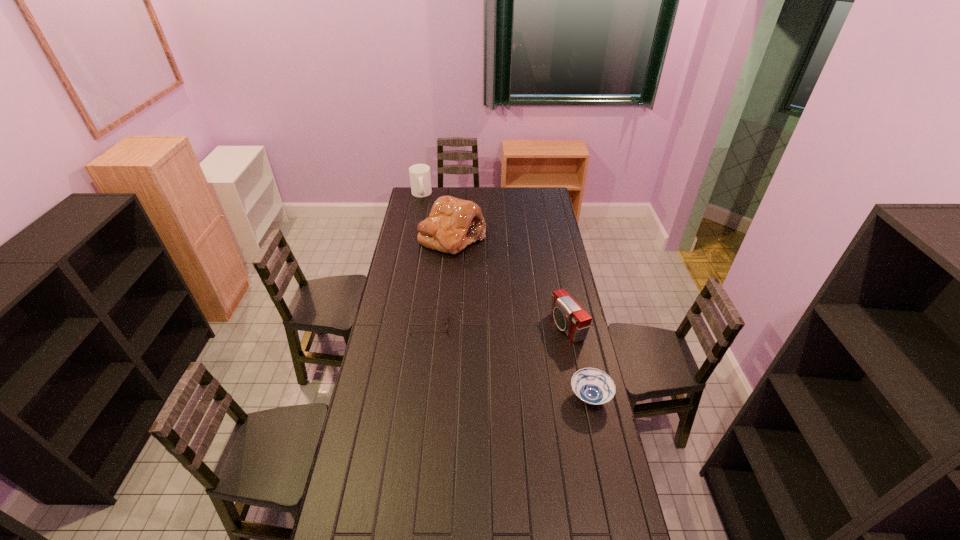
Where is `vacant region located on the filling side of the second farthest object`? This screenshot has height=540, width=960. vacant region located on the filling side of the second farthest object is located at coordinates [468, 272].

This screenshot has height=540, width=960. I want to click on free space located on the filling side of the second farthest object, so click(465, 265).

Find the location of `free space located on the handle side of the farthest object`. free space located on the handle side of the farthest object is located at coordinates (436, 225).

You are a GUI agent. You are given a task and a screenshot of the screen. Output one action in this format:
    pyautogui.click(x=<x>, y=<y>)
    Task: Click on the vacant space located 0.090m on the handle side of the farthest object
    This screenshot has height=540, width=960.
    Given the screenshot: What is the action you would take?
    pyautogui.click(x=427, y=208)

Locate an element on the screen. vacant space located 0.330m on the handle side of the farthest object is located at coordinates (437, 228).

Find the location of a particular element. free spot located on the front-facing side of the camera is located at coordinates [x=484, y=355].

In order to click on free point located 0.320m on the front-facing side of the camera in this screenshot , I will do `click(489, 354)`.

Locate an element on the screen. The width and height of the screenshot is (960, 540). free spot located 0.290m on the front-facing side of the camera is located at coordinates (495, 352).

Find the location of `object that is positioned at the far edge`. object that is positioned at the far edge is located at coordinates (420, 179).

Identify the location of sunglasses present at the left edge. (416, 308).